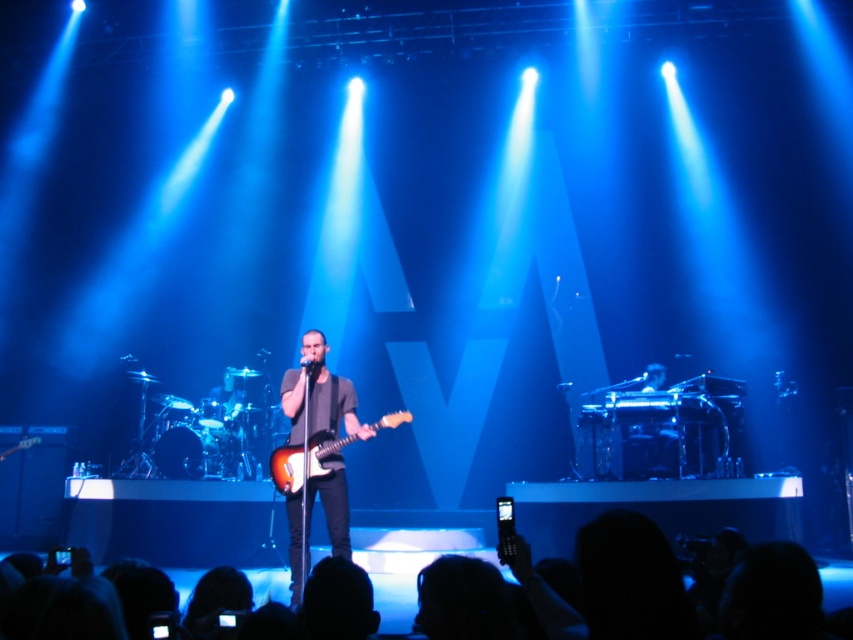
Question: Which of the following is the farthest from the observer?

Choices:
 (A) sunburst wood electric guitar at center
 (B) silhouette hair at lower center

Answer: (B)

Question: Is satin black guitar at center positioned before silhouette hair at lower center?

Choices:
 (A) yes
 (B) no

Answer: (A)

Question: Considering the relative positions of satin black guitar at center and sunburst wood electric guitar at center in the image provided, where is satin black guitar at center located with respect to sunburst wood electric guitar at center?

Choices:
 (A) right
 (B) left

Answer: (B)

Question: Which point is farther to the camera?

Choices:
 (A) satin black guitar at center
 (B) sunburst wood electric guitar at center
 (C) silhouette hair at lower center

Answer: (C)

Question: Can you confirm if satin black guitar at center is smaller than sunburst wood electric guitar at center?

Choices:
 (A) no
 (B) yes

Answer: (A)

Question: Which of the following is the farthest from the observer?

Choices:
 (A) click(303, 460)
 (B) click(376, 598)
 (C) click(302, 534)

Answer: (B)